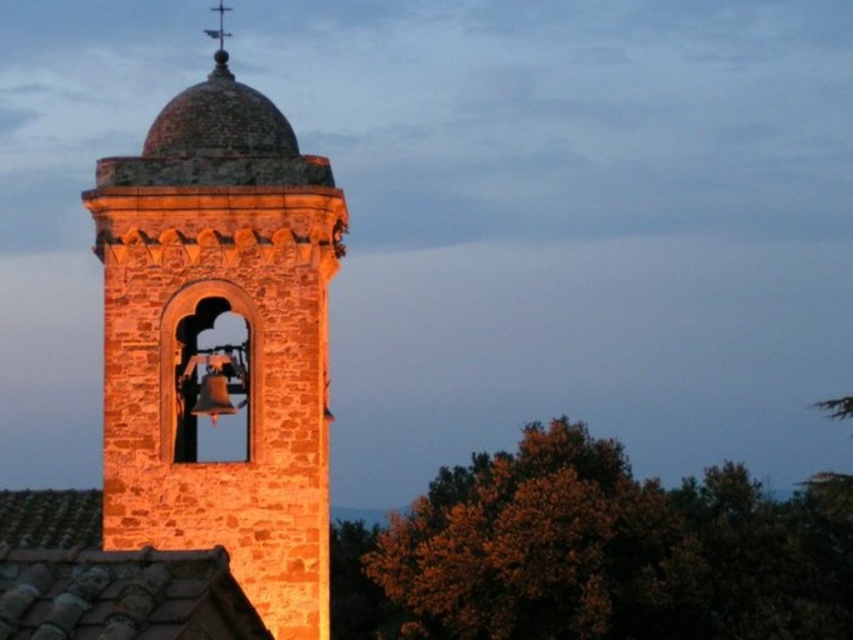
Is point (111, 296) behind point (218, 45)?

No.

Who is more forward, [209,93] or [228,33]?

Point [209,93] is more forward.

Find the location of `rustic stone bell tower at center`. rustic stone bell tower at center is located at coordinates (225, 346).